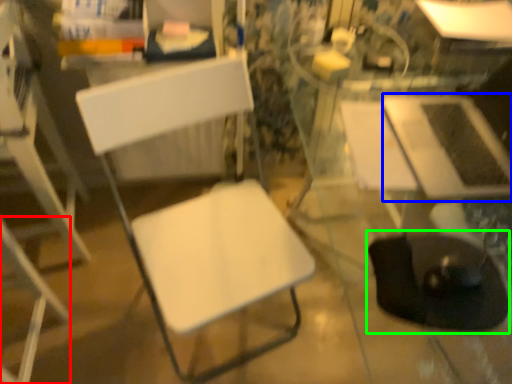
Question: Which object is the farthest from chair (highlighted by a red box)? Choose among these: table (highlighted by a blue box) or swivel chair (highlighted by a green box).

Choices:
 (A) table
 (B) swivel chair

Answer: (A)